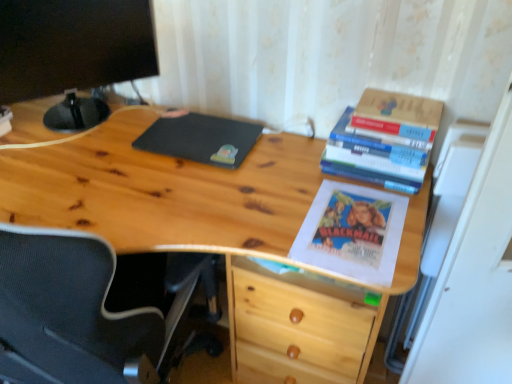
Question: Can you confirm if black matte mousepad at center is shorter than natural wood desk at center?

Choices:
 (A) no
 (B) yes

Answer: (B)

Question: From a real-world perspective, is black matte mousepad at center below natural wood desk at center?

Choices:
 (A) no
 (B) yes

Answer: (A)

Question: From the image's perspective, does black matte mousepad at center appear lower than natural wood desk at center?

Choices:
 (A) no
 (B) yes

Answer: (A)

Question: From a real-world perspective, is black matte mousepad at center positioned over natural wood desk at center based on gravity?

Choices:
 (A) no
 (B) yes

Answer: (B)

Question: Would you say black matte mousepad at center contains natural wood desk at center?

Choices:
 (A) no
 (B) yes

Answer: (A)

Question: Is point (143, 233) positioned closer to the camera than point (353, 132)?

Choices:
 (A) closer
 (B) farther

Answer: (A)

Question: Would you say natural wood desk at center is inside or outside hardcover book at upper right, which is the second book in bottom-to-top order?

Choices:
 (A) outside
 (B) inside

Answer: (A)

Question: Based on their sizes in the image, would you say natural wood desk at center is bigger or smaller than hardcover book at upper right, which is the second book in bottom-to-top order?

Choices:
 (A) small
 (B) big

Answer: (B)

Question: From a real-world perspective, is natural wood desk at center above or below hardcover book at upper right, which appears as the first book when viewed from the top?

Choices:
 (A) below
 (B) above

Answer: (A)

Question: Considering the positions of black matte mousepad at center and black matte computer monitor at upper left in the image, is black matte mousepad at center wider or thinner than black matte computer monitor at upper left?

Choices:
 (A) thin
 (B) wide

Answer: (B)

Question: In the image, is black matte mousepad at center positioned in front of or behind black matte computer monitor at upper left?

Choices:
 (A) behind
 (B) front

Answer: (A)

Question: In the image, is black matte mousepad at center on the left side or the right side of black matte computer monitor at upper left?

Choices:
 (A) left
 (B) right

Answer: (B)

Question: From a real-world perspective, is black matte mousepad at center physically located above or below black matte computer monitor at upper left?

Choices:
 (A) below
 (B) above

Answer: (A)

Question: In terms of height, does black matte mousepad at center look taller or shorter compared to natural wood desk at center?

Choices:
 (A) short
 (B) tall

Answer: (A)

Question: From the image's perspective, relative to natural wood desk at center, is black matte mousepad at center above or below?

Choices:
 (A) below
 (B) above

Answer: (B)